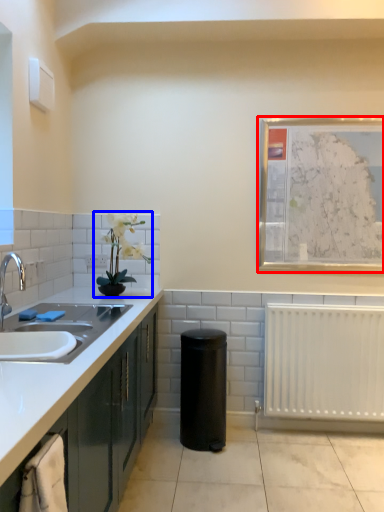
Question: Which object appears farthest to the camera in this image, picture frame (highlighted by a red box) or houseplant (highlighted by a blue box)?

Choices:
 (A) picture frame
 (B) houseplant

Answer: (A)